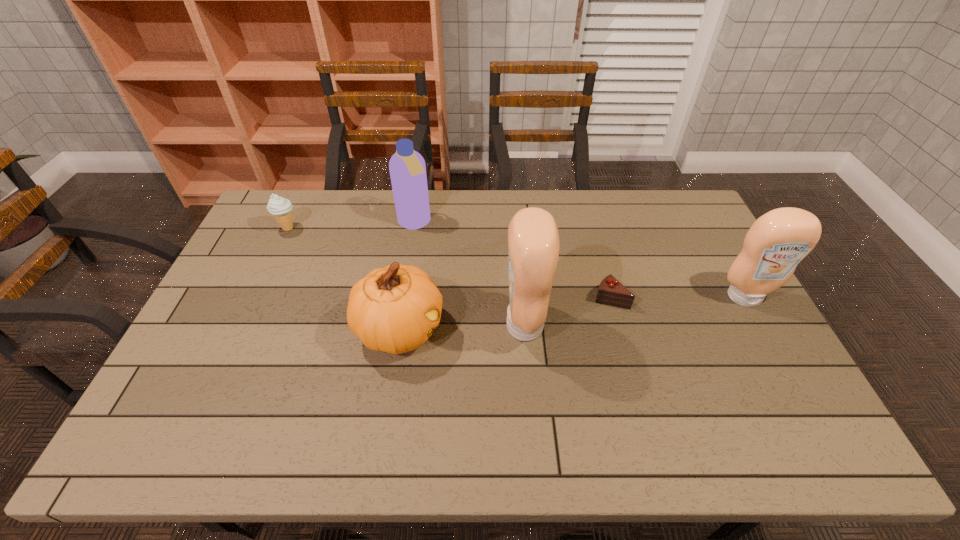
At what (x,y) coordinates should I click in order to perform the action: click on unoccupied area between the third shortest object and the right condiment. Please return your answer as a coordinate pair (x, y). Looking at the image, I should click on (572, 313).

Find the location of a particular element. Image resolution: width=960 pixels, height=540 pixels. unoccupied position between the fourth object from left to right and the shampoo is located at coordinates pyautogui.click(x=469, y=274).

The image size is (960, 540). I want to click on vacant area between the chocolate cake and the third shortest object, so click(x=505, y=314).

Image resolution: width=960 pixels, height=540 pixels. In order to click on vacant area that lies between the pumpkin and the shortest object in this screenshot , I will do `click(505, 314)`.

The width and height of the screenshot is (960, 540). Identify the location of vacant space in between the shampoo and the icecream. (351, 226).

Image resolution: width=960 pixels, height=540 pixels. Find the location of `empty location between the fourth object from left to right and the fourth tallest object`. empty location between the fourth object from left to right and the fourth tallest object is located at coordinates (462, 327).

What are the coordinates of `blank region between the pumpkin and the fifth tallest object` in the screenshot? It's located at (344, 279).

Find the location of `unoccupied area between the fifth object from left to right and the pumpkin`. unoccupied area between the fifth object from left to right and the pumpkin is located at coordinates (505, 314).

The image size is (960, 540). What are the coordinates of `object that stands as the closest to the shampoo` in the screenshot? It's located at (394, 309).

Identify which object is the closest to the chocolate cake. Please provide its 2D coordinates. Your answer should be formatted as a tuple, i.e. [(x, y)], where the tuple contains the x and y coordinates of a point satisfying the conditions above.

[(533, 239)]